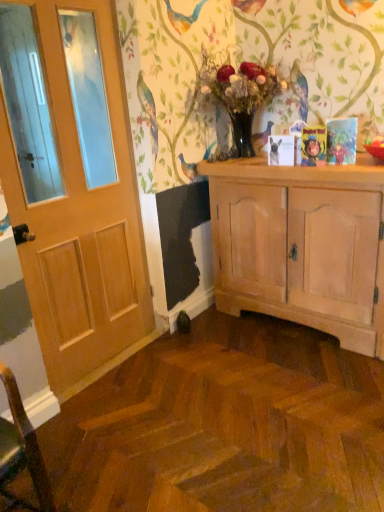
The image size is (384, 512). What do you see at coordinates (274, 151) in the screenshot?
I see `matte white dog at center` at bounding box center [274, 151].

I want to click on translucent glass vase at center, so click(240, 98).

Locate an element on the screen. cartoon character book at upper right is located at coordinates (313, 146).

Is translucent glass vase at center facing towards light wood cabinet at center?

No, translucent glass vase at center is not turned towards light wood cabinet at center.

You are a GUI agent. You are given a task and a screenshot of the screen. Output one action in this format:
    pyautogui.click(x=<x>, y=<y>)
    Task: Click on the floral arrangement above the light wood cabinet at center (from the image's perspective)
    Image resolution: width=384 pixels, height=512 pixels.
    Given the screenshot: What is the action you would take?
    pyautogui.click(x=240, y=98)

Between translucent glass vase at center and light wood cabinet at center, which one has larger size?

light wood cabinet at center.

Does translucent glass vase at center have a greater width compared to light wood cabinet at center?

No, translucent glass vase at center is not wider than light wood cabinet at center.

Does translucent glass vase at center turn towards matte white dog at center?

No, translucent glass vase at center is not oriented towards matte white dog at center.

Based on the photo, from a real-world perspective, is translucent glass vase at center positioned over matte white dog at center based on gravity?

Correct, in the physical world, translucent glass vase at center is higher than matte white dog at center.

Can you tell me how much translucent glass vase at center and matte white dog at center differ in facing direction?

There is a 2.34-degree angle between the facing directions of translucent glass vase at center and matte white dog at center.

Where is `floral arrangement in front of the matte white dog at center`? Image resolution: width=384 pixels, height=512 pixels. floral arrangement in front of the matte white dog at center is located at coordinates (240, 98).

Is light wood cabinet at center in front of matte white dog at center?

Yes, light wood cabinet at center is in front of matte white dog at center.

Is light wood cabinet at center thinner than matte white dog at center?

No, light wood cabinet at center is not thinner than matte white dog at center.

From the image's perspective, would you say light wood cabinet at center is positioned over matte white dog at center?

No, from the image's perspective, light wood cabinet at center is not above matte white dog at center.

What are the coordinates of `cabinetry located below the cartoon character book at upper right (from the image's perspective)` in the screenshot? It's located at (301, 246).

Is cartoon character book at upper right touching light wood cabinet at center?

cartoon character book at upper right and light wood cabinet at center are clearly separated.

Is cartoon character book at upper right turned away from light wood cabinet at center?

cartoon character book at upper right does not have its back to light wood cabinet at center.

Is cartoon character book at upper right further to camera compared to light wood cabinet at center?

Yes.

Is cartoon character book at upper right in front of wooden door at left?

That is False.

Is cartoon character book at upper right touching wooden door at left?

No, cartoon character book at upper right is not next to wooden door at left.

Is cartoon character book at upper right positioned with its back to wooden door at left?

No, cartoon character book at upper right's orientation is not away from wooden door at left.

Where is `door in front of the cartoon character book at upper right`? door in front of the cartoon character book at upper right is located at coordinates (81, 219).

Which is behind, light wood cabinet at center or cartoon character book at upper right?

cartoon character book at upper right is more distant.

Between light wood cabinet at center and cartoon character book at upper right, which one has smaller width?

cartoon character book at upper right.

Consider the image. Is cartoon character book at upper right located within light wood cabinet at center?

That's incorrect, cartoon character book at upper right is not inside light wood cabinet at center.

Is light wood cabinet at center shorter than cartoon character book at upper right?

Incorrect, the height of light wood cabinet at center does not fall short of that of cartoon character book at upper right.

Between matte white dog at center and cartoon character book at upper right, which one has smaller width?

matte white dog at center.

Who is taller, matte white dog at center or cartoon character book at upper right?

Standing taller between the two is cartoon character book at upper right.

From the image's perspective, is matte white dog at center located above cartoon character book at upper right?

No, from the image's perspective, matte white dog at center is not on top of cartoon character book at upper right.

Could cartoon character book at upper right be considered to be inside matte white dog at center?

No, cartoon character book at upper right is not a part of matte white dog at center.

Where is `floral arrangement to the left of light wood cabinet at center`? floral arrangement to the left of light wood cabinet at center is located at coordinates (240, 98).

Identify the location of floral arrangement that is in front of the matte white dog at center. The width and height of the screenshot is (384, 512). (240, 98).

Estimate the real-world distances between objects in this image. Which object is closer to translucent glass vase at center, wooden door at left or cartoon character book at upper right?

cartoon character book at upper right.

Estimate the real-world distances between objects in this image. Which object is closer to translucent glass vase at center, cartoon character book at upper right or matte white dog at center?

Among the two, matte white dog at center is located nearer to translucent glass vase at center.

Estimate the real-world distances between objects in this image. Which object is further from matte white dog at center, cartoon character book at upper right or wooden door at left?

wooden door at left is further to matte white dog at center.

Considering their positions, is matte white dog at center positioned further to translucent glass vase at center than cartoon character book at upper right?

Among the two, cartoon character book at upper right is located further to translucent glass vase at center.

From the image, which object appears to be nearer to wooden door at left, cartoon character book at upper right or matte white dog at center?

matte white dog at center is positioned closer to the anchor wooden door at left.

From the image, which object appears to be farther from light wood cabinet at center, wooden door at left or translucent glass vase at center?

wooden door at left is further to light wood cabinet at center.

From the image, which object appears to be farther from wooden door at left, matte white dog at center or cartoon character book at upper right?

Based on the image, cartoon character book at upper right appears to be further to wooden door at left.

Which object lies further to the anchor point matte white dog at center, light wood cabinet at center or cartoon character book at upper right?

light wood cabinet at center lies further to matte white dog at center than the other object.

This screenshot has height=512, width=384. What are the coordinates of `picture frame between wooden door at left and light wood cabinet at center in the horizontal direction` in the screenshot? It's located at (313, 146).

Where is `floral arrangement situated between wooden door at left and cartoon character book at upper right from left to right`? Image resolution: width=384 pixels, height=512 pixels. floral arrangement situated between wooden door at left and cartoon character book at upper right from left to right is located at coordinates pyautogui.click(x=240, y=98).

The height and width of the screenshot is (512, 384). I want to click on bird situated between wooden door at left and light wood cabinet at center from left to right, so click(274, 151).

Find the location of a particular element. This screenshot has height=512, width=384. picture frame that lies between translucent glass vase at center and light wood cabinet at center from top to bottom is located at coordinates (313, 146).